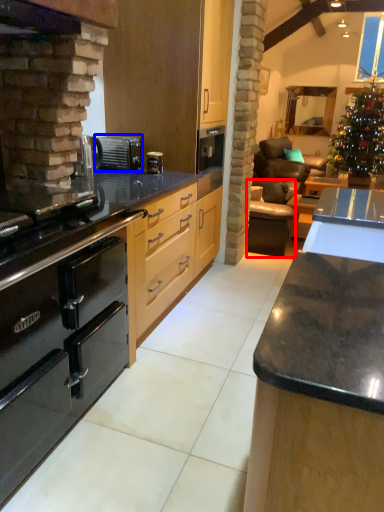
Question: Which of the following is the closest to the observer, armchair (highlighted by a red box) or appliance (highlighted by a blue box)?

Choices:
 (A) armchair
 (B) appliance

Answer: (B)